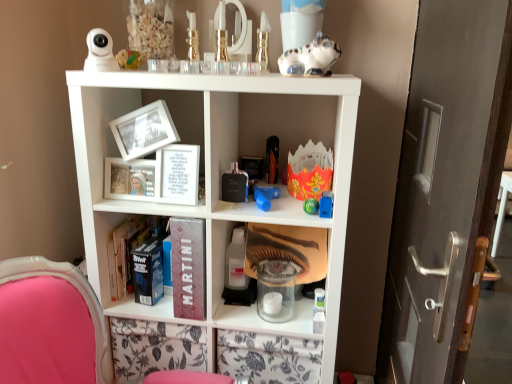
Question: Is blue rubber toy at center, marked as the fifth toy in a right-to-left arrangement, outside of metallic black perfume at center, arranged as the 5th toy when viewed from the top?

Choices:
 (A) yes
 (B) no

Answer: (A)

Question: Is blue rubber toy at center, which is counted as the fourth toy, starting from the bottom, positioned before metallic black perfume at center, the 7th toy when ordered from right to left?

Choices:
 (A) no
 (B) yes

Answer: (B)

Question: From the image's perspective, is blue rubber toy at center, marked as the fifth toy in a right-to-left arrangement, located beneath metallic black perfume at center, the 5th toy in the bottom-to-top sequence?

Choices:
 (A) yes
 (B) no

Answer: (A)

Question: From a real-world perspective, is blue rubber toy at center, positioned as the fifth toy in left-to-right order, positioned under metallic black perfume at center, the 5th toy in the bottom-to-top sequence, based on gravity?

Choices:
 (A) no
 (B) yes

Answer: (B)

Question: From a real-world perspective, is blue rubber toy at center, positioned as the fifth toy in left-to-right order, over metallic black perfume at center, the 7th toy when ordered from right to left?

Choices:
 (A) no
 (B) yes

Answer: (A)

Question: Can you confirm if blue rubber toy at center, which appears as the sixth toy when viewed from the top, is taller than metallic black perfume at center, the 7th toy when ordered from right to left?

Choices:
 (A) no
 (B) yes

Answer: (A)

Question: Is the position of shiny blue toy at center, the third toy positioned from the bottom, more distant than that of pink fabric swivel chair at lower left?

Choices:
 (A) no
 (B) yes

Answer: (B)

Question: Does shiny blue toy at center, the seventh toy when ordered from top to bottom, turn towards pink fabric swivel chair at lower left?

Choices:
 (A) yes
 (B) no

Answer: (B)

Question: Does shiny blue toy at center, which is counted as the eighth toy, starting from the left, have a larger size compared to pink fabric swivel chair at lower left?

Choices:
 (A) no
 (B) yes

Answer: (A)

Question: Is shiny blue toy at center, the third toy positioned from the bottom, oriented away from pink fabric swivel chair at lower left?

Choices:
 (A) no
 (B) yes

Answer: (A)

Question: Does shiny blue toy at center, the seventh toy when ordered from top to bottom, appear on the left side of pink fabric swivel chair at lower left?

Choices:
 (A) yes
 (B) no

Answer: (B)

Question: From the image's perspective, is shiny blue toy at center, which ranks as the second toy in right-to-left order, over pink fabric swivel chair at lower left?

Choices:
 (A) no
 (B) yes

Answer: (B)

Question: Can blue plastic toy at center, placed as the 2th toy when sorted from bottom to top, be found inside dark matte book at center, the 2th book viewed from the top?

Choices:
 (A) no
 (B) yes

Answer: (A)